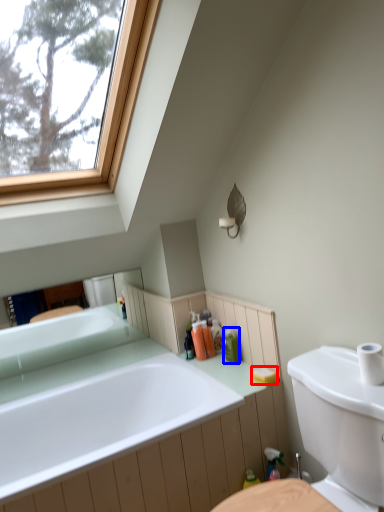
Question: Which of the following is the farthest to the observer, soap (highlighted by a red box) or toiletry (highlighted by a blue box)?

Choices:
 (A) soap
 (B) toiletry

Answer: (B)